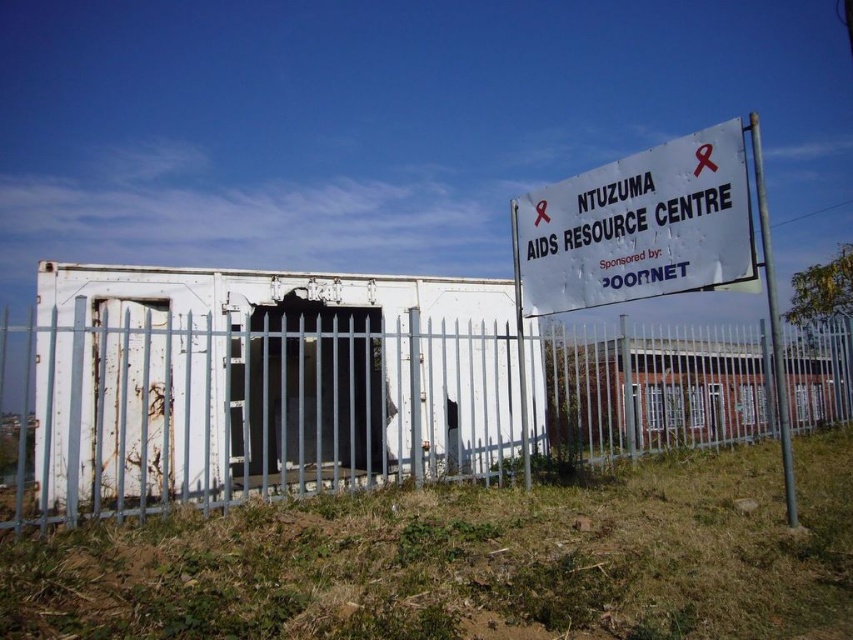
Is point (849, 385) farther from viewer compared to point (114, 429)?

Yes, point (849, 385) is behind point (114, 429).

The height and width of the screenshot is (640, 853). What do you see at coordinates (352, 408) in the screenshot?
I see `rusty metal fence at center` at bounding box center [352, 408].

Does point (144, 438) come farther from viewer compared to point (163, 445)?

No, (144, 438) is closer to viewer.

What are the coordinates of `rusty metal fence at center` in the screenshot? It's located at (352, 408).

Does rusty metal cage at center have a smaller size compared to white paper sign at upper right?

No.

Is rusty metal cage at center shorter than white paper sign at upper right?

No.

Find the location of `rusty metal cage at center`. rusty metal cage at center is located at coordinates (271, 376).

Is rusty metal fence at center below rusty metal cage at center?

Yes, rusty metal fence at center is below rusty metal cage at center.

Between rusty metal fence at center and rusty metal cage at center, which one appears on the right side from the viewer's perspective?

From the viewer's perspective, rusty metal cage at center appears more on the right side.

Is point (141, 368) positioned in front of point (468, 374)?

Yes, point (141, 368) is in front of point (468, 374).

Where is `rusty metal fence at center`? The width and height of the screenshot is (853, 640). rusty metal fence at center is located at coordinates (352, 408).